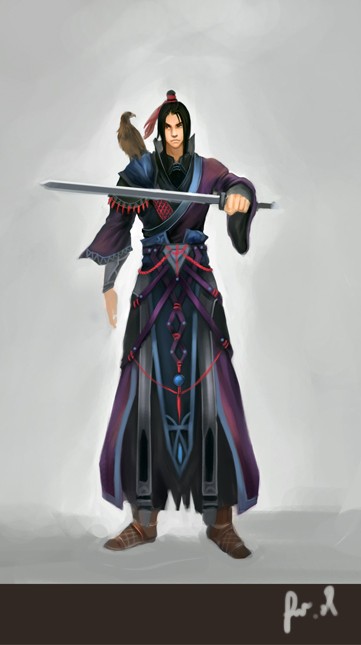
Identify the location of coat. The width and height of the screenshot is (361, 645). (212, 422).